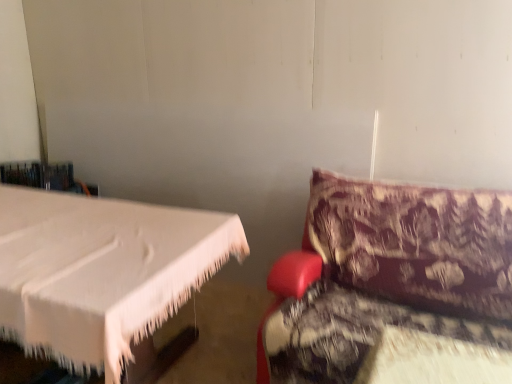
Describe the element at coordinates (386, 275) in the screenshot. This screenshot has height=384, width=512. I see `velvet burgundy couch at right` at that location.

Looking at this image, what is the approximate height of velvet burgundy couch at right?

It is 28.95 inches.

I want to click on velvet burgundy couch at right, so click(386, 275).

This screenshot has width=512, height=384. Identify the location of velvet burgundy couch at right. (386, 275).